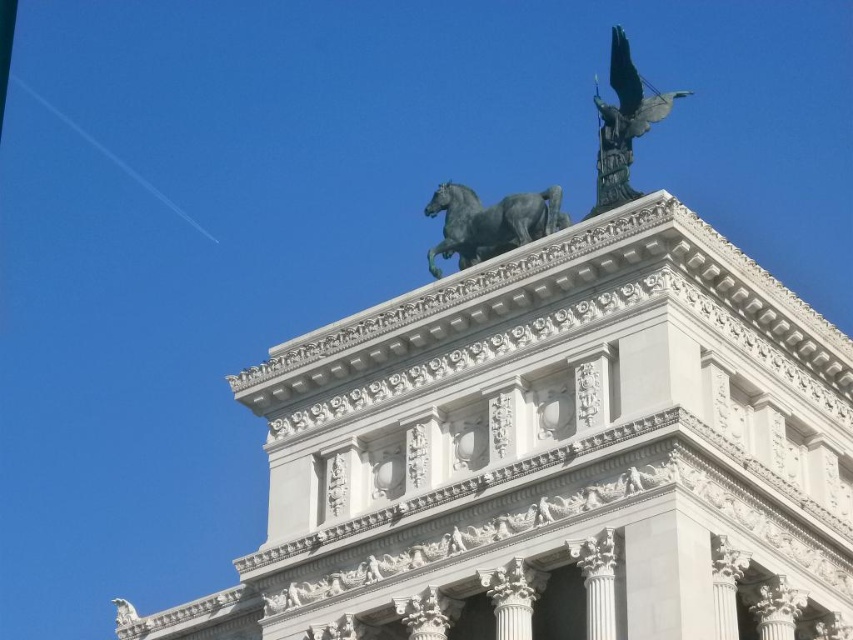
Question: Which point appears closest to the camera in this image?

Choices:
 (A) (460, 192)
 (B) (627, 157)
 (C) (602, 524)

Answer: (C)

Question: Among these points, which one is nearest to the camera?

Choices:
 (A) (473, 250)
 (B) (310, 544)
 (C) (618, 84)

Answer: (B)

Question: Which point is closer to the camera taking this photo?

Choices:
 (A) (228, 632)
 (B) (548, 204)
 (C) (614, 48)

Answer: (B)

Question: Can you confirm if shiny black horse at top center is positioned to the left of green patina eagle at upper center?

Choices:
 (A) yes
 (B) no

Answer: (A)

Question: In this image, where is green polished stone tower at upper center located relative to green patina eagle at upper center?

Choices:
 (A) above
 (B) below

Answer: (B)

Question: Can you confirm if shiny black horse at top center is positioned above green patina eagle at upper center?

Choices:
 (A) no
 (B) yes

Answer: (A)